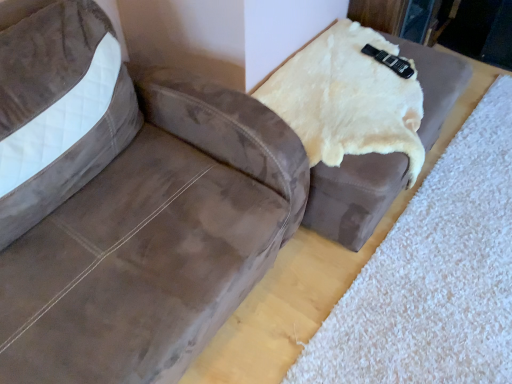
Identify the location of free spot below white fluffy cat bed at upper right (from a real-world perspective). (451, 250).